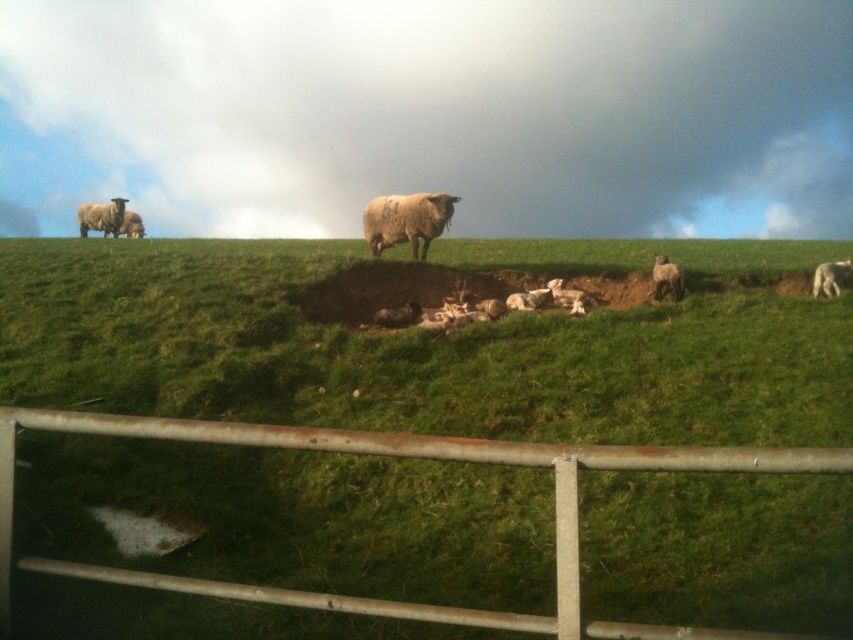
Is rusty metal fence at lower center below white woolly sheep at center?

Yes.

Does rusty metal fence at lower center have a greater height compared to white woolly sheep at center?

Correct, rusty metal fence at lower center is much taller as white woolly sheep at center.

What do you see at coordinates (407, 456) in the screenshot?
I see `rusty metal fence at lower center` at bounding box center [407, 456].

The height and width of the screenshot is (640, 853). What are the coordinates of `rusty metal fence at lower center` in the screenshot? It's located at (407, 456).

Based on the photo, who is more distant from viewer, (x=84, y=230) or (x=837, y=272)?

The point (x=84, y=230) is more distant.

Based on the photo, does white woolly sheep at upper left lie in front of white woolly sheep at center?

That is False.

Does point (114, 196) come in front of point (839, 282)?

No, it is behind (839, 282).

This screenshot has width=853, height=640. Find the location of `white woolly sheep at upper left`. white woolly sheep at upper left is located at coordinates (102, 216).

Is white woolly sheep at upper left to the right of white woolen sheep at center from the viewer's perspective?

Incorrect, white woolly sheep at upper left is not on the right side of white woolen sheep at center.

Can you confirm if white woolly sheep at upper left is taller than white woolen sheep at center?

Yes.

Does point (125, 198) lie in front of point (656, 284)?

No, (125, 198) is further to viewer.

Locate an element on the screen. white woolly sheep at upper left is located at coordinates (102, 216).